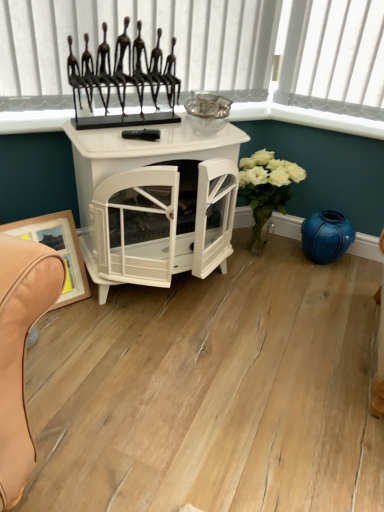
Where is `empty space that is ontop of white glossy fireplace at center`? empty space that is ontop of white glossy fireplace at center is located at coordinates (163, 131).